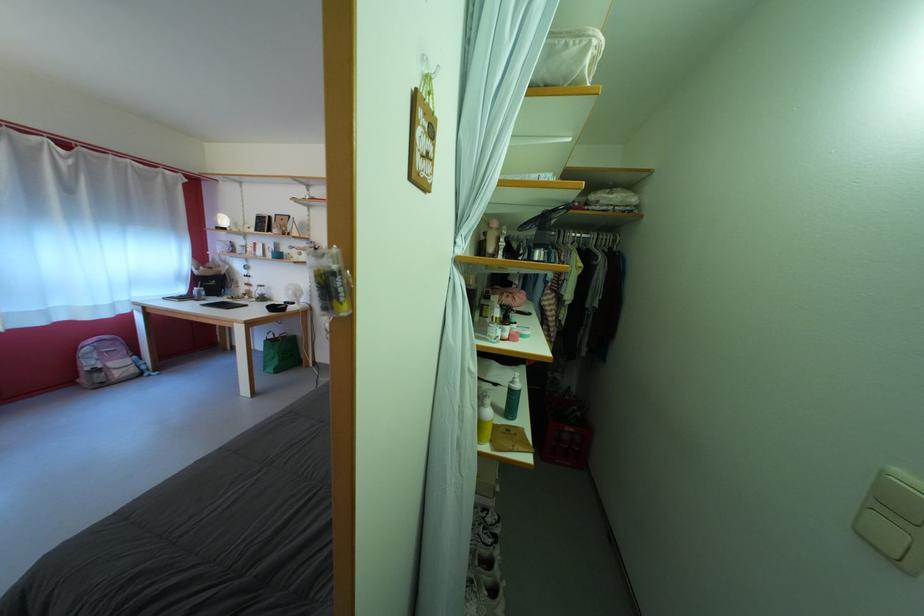
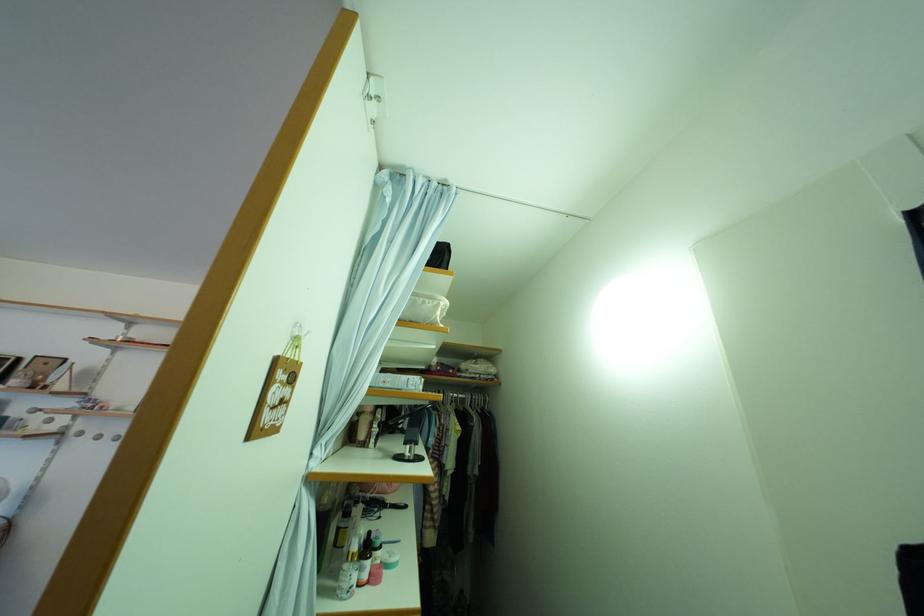
Find the pixel in the second image that matches pixel 432 62 in the first image.

(305, 329)